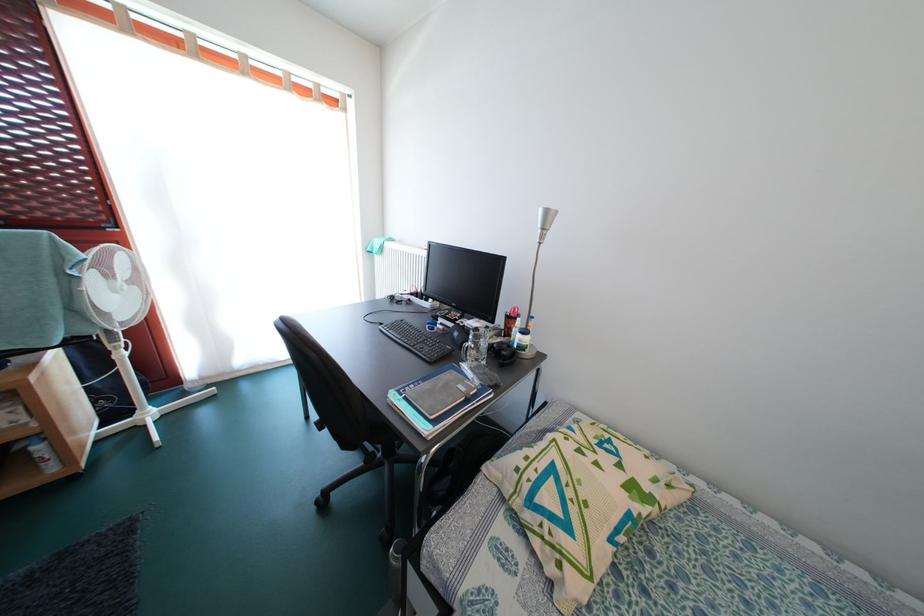
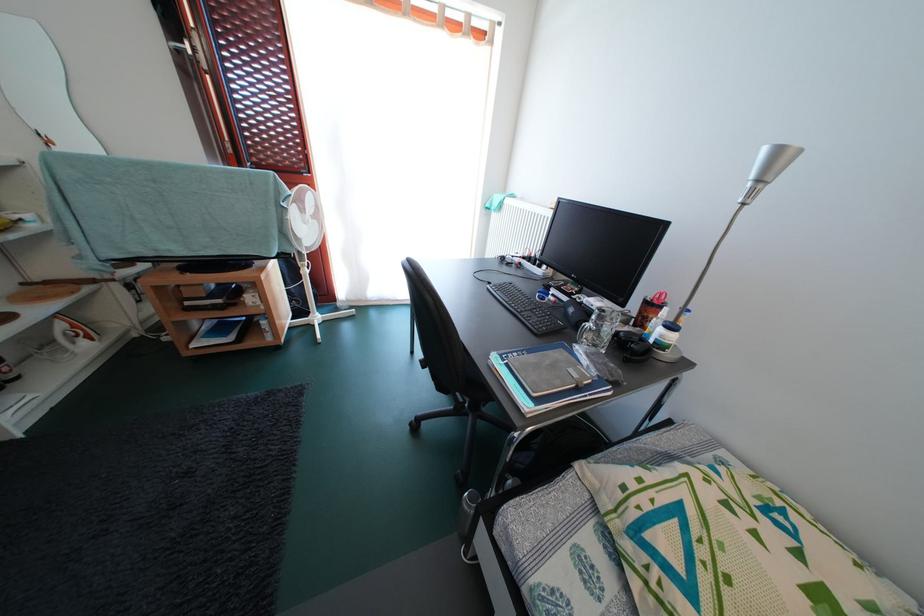
In the second image, find the point that corresponds to (517,323) in the first image.

(658, 310)